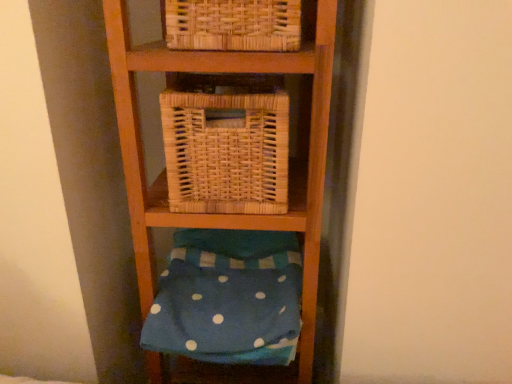
At what (x,y) coordinates should I click in order to perform the action: click on blue polka dot fabric at lower center. Please return your answer as a coordinate pair (x, y). Image resolution: width=512 pixels, height=384 pixels. Looking at the image, I should click on (226, 314).

What do you see at coordinates (226, 314) in the screenshot?
I see `blue polka dot fabric at lower center` at bounding box center [226, 314].

Describe the element at coordinates (226, 151) in the screenshot. I see `woven natural basket at center` at that location.

I want to click on woven natural basket at center, so click(x=226, y=151).

Locate an element on the screen. Image resolution: width=512 pixels, height=384 pixels. blue polka dot fabric at lower center is located at coordinates (226, 314).

Is blue polka dot fabric at lower center at the right side of woven natural basket at center?

In fact, blue polka dot fabric at lower center is to the left of woven natural basket at center.

Is blue polka dot fabric at lower center closer to the viewer compared to woven natural basket at center?

No, blue polka dot fabric at lower center is further to the viewer.

Does point (236, 344) come closer to viewer compared to point (211, 111)?

No.

From the image's perspective, is blue polka dot fabric at lower center beneath woven natural basket at center?

Yes, from the image's perspective, blue polka dot fabric at lower center is beneath woven natural basket at center.

From a real-world perspective, is blue polka dot fabric at lower center under woven natural basket at center?

Yes, from a real-world perspective, blue polka dot fabric at lower center is below woven natural basket at center.

Considering the relative sizes of blue polka dot fabric at lower center and woven natural basket at center in the image provided, is blue polka dot fabric at lower center wider than woven natural basket at center?

Indeed, blue polka dot fabric at lower center has a greater width compared to woven natural basket at center.

Consider the image. Does blue polka dot fabric at lower center have a lesser height compared to woven natural basket at center?

Yes, blue polka dot fabric at lower center is shorter than woven natural basket at center.

Can you confirm if blue polka dot fabric at lower center is bigger than woven natural basket at center?

Indeed, blue polka dot fabric at lower center has a larger size compared to woven natural basket at center.

Consider the image. Is blue polka dot fabric at lower center outside of woven natural basket at center?

Yes, blue polka dot fabric at lower center is outside of woven natural basket at center.

Is blue polka dot fabric at lower center next to woven natural basket at center?

No, blue polka dot fabric at lower center is not next to woven natural basket at center.

Is blue polka dot fabric at lower center oriented away from woven natural basket at center?

No.

Find the location of `pillow below the woven natural basket at center (from the image's perspective)`. pillow below the woven natural basket at center (from the image's perspective) is located at coordinates (226, 314).

Between woven natural basket at center and blue polka dot fabric at lower center, which one appears on the right side from the viewer's perspective?

woven natural basket at center is more to the right.

Which object is closer to the camera, woven natural basket at center or blue polka dot fabric at lower center?

woven natural basket at center is in front.

Is point (182, 119) behind point (301, 275)?

No.

From the picture: From the image's perspective, is woven natural basket at center located beneath blue polka dot fabric at lower center?

Actually, woven natural basket at center appears above blue polka dot fabric at lower center in the image.

From a real-world perspective, is woven natural basket at center physically below blue polka dot fabric at lower center?

Actually, woven natural basket at center is physically above blue polka dot fabric at lower center in the real world.

Does woven natural basket at center have a greater width compared to blue polka dot fabric at lower center?

Incorrect, the width of woven natural basket at center does not surpass that of blue polka dot fabric at lower center.

From their relative heights in the image, would you say woven natural basket at center is taller or shorter than blue polka dot fabric at lower center?

Considering their sizes, woven natural basket at center has more height than blue polka dot fabric at lower center.

Between woven natural basket at center and blue polka dot fabric at lower center, which one has smaller size?

woven natural basket at center is smaller.

Is woven natural basket at center located outside blue polka dot fabric at lower center?

Yes, woven natural basket at center is located beyond the bounds of blue polka dot fabric at lower center.

Is woven natural basket at center not close to blue polka dot fabric at lower center?

No, woven natural basket at center is not far away from blue polka dot fabric at lower center.

Is woven natural basket at center oriented away from blue polka dot fabric at lower center?

woven natural basket at center does not have its back to blue polka dot fabric at lower center.

Image resolution: width=512 pixels, height=384 pixels. I want to click on pillow below the woven natural basket at center (from a real-world perspective), so click(x=226, y=314).

The image size is (512, 384). What are the coordinates of `basket on the right of the blue polka dot fabric at lower center` in the screenshot? It's located at (226, 151).

Identify the location of basket positioned vertically above the blue polka dot fabric at lower center (from a real-world perspective). (226, 151).